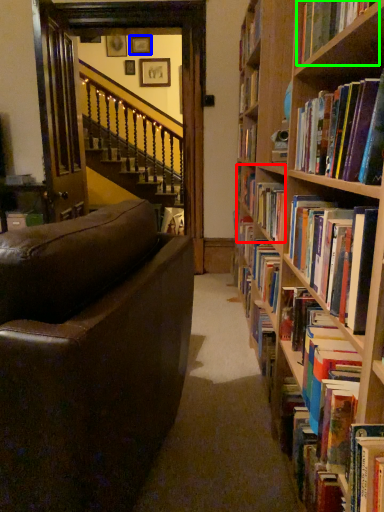
Question: Estimate the real-world distances between objects in this image. Which object is closer to book (highlighted by a red box), picture frame (highlighted by a blue box) or book (highlighted by a green box)?

Choices:
 (A) picture frame
 (B) book

Answer: (B)